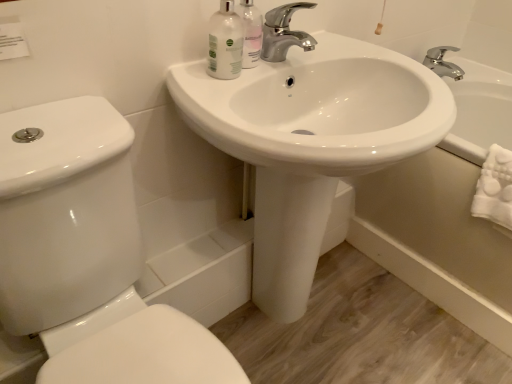
You are a GUI agent. You are given a task and a screenshot of the screen. Output one action in this format:
    pyautogui.click(x=<x>, y=<y>)
    Task: Click on the translucent plastic mouthwash at upper center, the 1th mouthwash from the right
    This screenshot has height=384, width=512.
    Given the screenshot: What is the action you would take?
    pyautogui.click(x=251, y=32)

Measure the distance between translucent plastic mouthwash at upper center, placed as the second mouthwash when sorted from left to right, and camera.

A distance of 35.04 inches exists between translucent plastic mouthwash at upper center, placed as the second mouthwash when sorted from left to right, and camera.

Find the location of a particular element. This screenshot has height=384, width=512. white glossy bathtub at lower right is located at coordinates click(446, 212).

Find the location of `translucent plastic mouthwash at upper center, placed as the second mouthwash when sorted from left to right`. translucent plastic mouthwash at upper center, placed as the second mouthwash when sorted from left to right is located at coordinates (251, 32).

Is white glossy bottle at upper center, acting as the 2th mouthwash starting from the right, in contact with white glossy sink at center?

They are not placed beside each other.

Could you tell me if white glossy bottle at upper center, acting as the 2th mouthwash starting from the right, is facing white glossy sink at center?

No, white glossy bottle at upper center, acting as the 2th mouthwash starting from the right, is not turned towards white glossy sink at center.

Does white glossy bottle at upper center, acting as the 2th mouthwash starting from the right, have a larger size compared to white glossy sink at center?

No.

Is white glossy bottle at upper center, the 1th mouthwash viewed from the left, to the right of white glossy sink at center from the viewer's perspective?

Incorrect, white glossy bottle at upper center, the 1th mouthwash viewed from the left, is not on the right side of white glossy sink at center.

From the picture: Can you confirm if chrome metallic faucet at upper center is positioned to the right of white glossy bathtub at lower right?

No, chrome metallic faucet at upper center is not to the right of white glossy bathtub at lower right.

Find the location of `tap on the left of white glossy bathtub at lower right`. tap on the left of white glossy bathtub at lower right is located at coordinates (284, 32).

Does chrome metallic faucet at upper center have a lesser width compared to white glossy bathtub at lower right?

Yes, chrome metallic faucet at upper center is thinner than white glossy bathtub at lower right.

Does point (284, 24) lie in front of point (372, 208)?

Yes, it is in front of point (372, 208).

Consider the image. Is the surface of white glossy sink at center in direct contact with chrome metallic faucet at upper center?

There is a gap between white glossy sink at center and chrome metallic faucet at upper center.

How different are the orientations of white glossy sink at center and chrome metallic faucet at upper center in degrees?

The angle between the facing direction of white glossy sink at center and the facing direction of chrome metallic faucet at upper center is 0.135 degrees.

From a real-world perspective, between white glossy sink at center and chrome metallic faucet at upper center, who is vertically lower?

white glossy sink at center, from a real-world perspective.

Is white glossy sink at center situated inside chrome metallic faucet at upper center or outside?

white glossy sink at center lies outside chrome metallic faucet at upper center.

Which is more to the left, white glossy sink at center or white glossy toilet at lower left?

Positioned to the left is white glossy toilet at lower left.

Can you confirm if white glossy sink at center is smaller than white glossy toilet at lower left?

No, white glossy sink at center is not smaller than white glossy toilet at lower left.

Could you tell me if white glossy sink at center is facing white glossy toilet at lower left?

No, white glossy sink at center is not facing towards white glossy toilet at lower left.

Considering the relative positions of white glossy sink at center and white glossy toilet at lower left in the image provided, is white glossy sink at center behind white glossy toilet at lower left?

Yes, it is.

From the image's perspective, relative to white glossy toilet at lower left, is translucent plastic mouthwash at upper center, the 1th mouthwash from the right, above or below?

Clearly, from the image's perspective, translucent plastic mouthwash at upper center, the 1th mouthwash from the right, is above white glossy toilet at lower left.

From a real-world perspective, who is located lower, translucent plastic mouthwash at upper center, placed as the second mouthwash when sorted from left to right, or white glossy toilet at lower left?

white glossy toilet at lower left, from a real-world perspective.

Considering the relative positions of white glossy bottle at upper center, acting as the 2th mouthwash starting from the right, and translucent plastic mouthwash at upper center, the 1th mouthwash from the right, in the image provided, is white glossy bottle at upper center, acting as the 2th mouthwash starting from the right, behind translucent plastic mouthwash at upper center, the 1th mouthwash from the right,?

No, it is not.

Considering the sizes of objects white glossy bottle at upper center, the 1th mouthwash viewed from the left, and translucent plastic mouthwash at upper center, placed as the second mouthwash when sorted from left to right, in the image provided, who is shorter, white glossy bottle at upper center, the 1th mouthwash viewed from the left, or translucent plastic mouthwash at upper center, placed as the second mouthwash when sorted from left to right,?

With less height is white glossy bottle at upper center, the 1th mouthwash viewed from the left.

Based on the photo, between white glossy bottle at upper center, the 1th mouthwash viewed from the left, and translucent plastic mouthwash at upper center, placed as the second mouthwash when sorted from left to right, which one appears on the right side from the viewer's perspective?

From the viewer's perspective, translucent plastic mouthwash at upper center, placed as the second mouthwash when sorted from left to right, appears more on the right side.

Which of these two, white glossy bottle at upper center, acting as the 2th mouthwash starting from the right, or translucent plastic mouthwash at upper center, the 1th mouthwash from the right, is smaller?

translucent plastic mouthwash at upper center, the 1th mouthwash from the right.

From the picture: Can you confirm if white glossy bottle at upper center, the 1th mouthwash viewed from the left, is positioned to the left of white glossy toilet at lower left?

No.

Is the position of white glossy bottle at upper center, the 1th mouthwash viewed from the left, more distant than that of white glossy toilet at lower left?

Yes, white glossy bottle at upper center, the 1th mouthwash viewed from the left, is behind white glossy toilet at lower left.

Is white glossy bottle at upper center, acting as the 2th mouthwash starting from the right, beside white glossy toilet at lower left?

No.

From the image's perspective, is white glossy bottle at upper center, acting as the 2th mouthwash starting from the right, located above or below white glossy toilet at lower left?

white glossy bottle at upper center, acting as the 2th mouthwash starting from the right, is situated higher than white glossy toilet at lower left in the image.

Where is `sink that is in front of the white glossy bottle at upper center, the 1th mouthwash viewed from the left`? This screenshot has width=512, height=384. sink that is in front of the white glossy bottle at upper center, the 1th mouthwash viewed from the left is located at coordinates (311, 141).

Locate an element on the screen. bath below the chrome metallic faucet at upper center (from a real-world perspective) is located at coordinates tap(446, 212).

Looking at this image, based on their spatial positions, is white glossy toilet at lower left or chrome metallic faucet at upper center further from translucent plastic mouthwash at upper center, the 1th mouthwash from the right?

Based on the image, white glossy toilet at lower left appears to be further to translucent plastic mouthwash at upper center, the 1th mouthwash from the right.

Which object lies further to the anchor point white glossy sink at center, white glossy bottle at upper center, the 1th mouthwash viewed from the left, or white glossy toilet at lower left?

white glossy toilet at lower left is positioned further to the anchor white glossy sink at center.

When comparing their distances from chrome metallic faucet at upper center, does white glossy sink at center or white glossy bottle at upper center, acting as the 2th mouthwash starting from the right, seem further?

white glossy sink at center.

Estimate the real-world distances between objects in this image. Which object is further from chrome metallic faucet at upper center, white glossy toilet at lower left or translucent plastic mouthwash at upper center, the 1th mouthwash from the right?

white glossy toilet at lower left is positioned further to the anchor chrome metallic faucet at upper center.

Considering their positions, is white glossy bathtub at lower right positioned further to translucent plastic mouthwash at upper center, the 1th mouthwash from the right, than white glossy bottle at upper center, the 1th mouthwash viewed from the left?

white glossy bathtub at lower right is positioned further to the anchor translucent plastic mouthwash at upper center, the 1th mouthwash from the right.

Estimate the real-world distances between objects in this image. Which object is further from white glossy sink at center, white glossy toilet at lower left or white glossy bathtub at lower right?

Based on the image, white glossy bathtub at lower right appears to be further to white glossy sink at center.

From the image, which object appears to be farther from white glossy bathtub at lower right, translucent plastic mouthwash at upper center, the 1th mouthwash from the right, or white glossy bottle at upper center, the 1th mouthwash viewed from the left?

white glossy bottle at upper center, the 1th mouthwash viewed from the left.

From the image, which object appears to be farther from white glossy toilet at lower left, white glossy bathtub at lower right or white glossy bottle at upper center, acting as the 2th mouthwash starting from the right?

white glossy bathtub at lower right is positioned further to the anchor white glossy toilet at lower left.

I want to click on tap between translucent plastic mouthwash at upper center, placed as the second mouthwash when sorted from left to right, and white glossy sink at center in the up-down direction, so click(284, 32).

Identify the location of tap between translucent plastic mouthwash at upper center, the 1th mouthwash from the right, and white glossy bathtub at lower right. [284, 32].

This screenshot has height=384, width=512. What are the coordinates of `tap between translucent plastic mouthwash at upper center, placed as the second mouthwash when sorted from left to right, and white glossy toilet at lower left in the up-down direction` in the screenshot? It's located at (284, 32).

Locate an element on the screen. This screenshot has width=512, height=384. mouthwash that lies between translucent plastic mouthwash at upper center, the 1th mouthwash from the right, and white glossy sink at center from top to bottom is located at coordinates (225, 43).